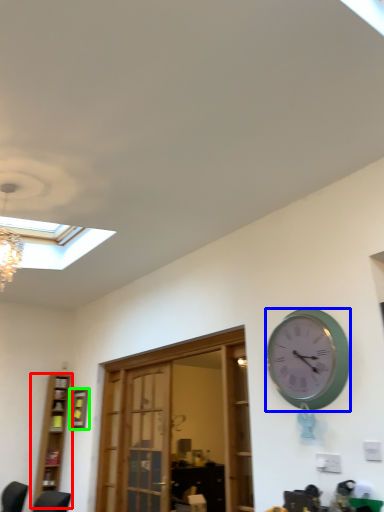
Question: Which object is positioned closest to bookshelf (highlighted by a red box)? Select from wall clock (highlighted by a blue box) and picture frame (highlighted by a green box).

Choices:
 (A) wall clock
 (B) picture frame

Answer: (B)